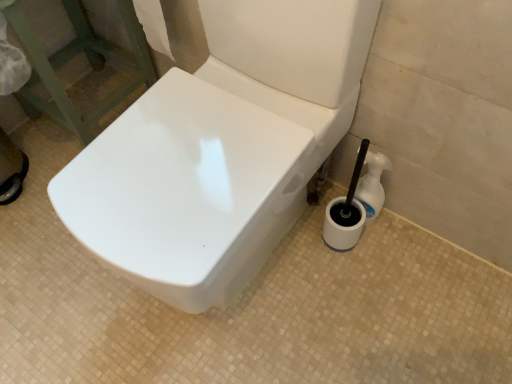
What do you see at coordinates (153, 25) in the screenshot?
I see `white paper at upper left` at bounding box center [153, 25].

Where is `white paper at upper left`? This screenshot has width=512, height=384. white paper at upper left is located at coordinates (153, 25).

Locate an element on the screen. The image size is (512, 384). white plastic bottle at lower right is located at coordinates (372, 185).

The height and width of the screenshot is (384, 512). What do you see at coordinates (372, 185) in the screenshot? I see `white plastic bottle at lower right` at bounding box center [372, 185].

Identify the location of white paper at upper left. This screenshot has height=384, width=512. (153, 25).

Which is more to the left, white plastic bottle at lower right or white paper at upper left?

white paper at upper left.

Which object is more forward, white plastic bottle at lower right or white paper at upper left?

white paper at upper left is more forward.

Does point (372, 187) appear closer or farther from the camera than point (156, 45)?

Point (372, 187).

From the image's perspective, between white plastic bottle at lower right and white paper at upper left, which one is located above?

white paper at upper left is shown above in the image.

From a real-world perspective, between white plastic bottle at lower right and white paper at upper left, who is vertically higher?

From a 3D spatial view, white paper at upper left is above.

Considering the sizes of objects white plastic bottle at lower right and white paper at upper left in the image provided, who is thinner, white plastic bottle at lower right or white paper at upper left?

With smaller width is white plastic bottle at lower right.

From their relative heights in the image, would you say white plastic bottle at lower right is taller or shorter than white paper at upper left?

In the image, white plastic bottle at lower right appears to be shorter than white paper at upper left.

Who is smaller, white plastic bottle at lower right or white paper at upper left?

Smaller between the two is white plastic bottle at lower right.

Is white plastic bottle at lower right outside of white paper at upper left?

Indeed, white plastic bottle at lower right is completely outside white paper at upper left.

Based on the photo, are white plastic bottle at lower right and white paper at upper left making contact?

No, white plastic bottle at lower right is not touching white paper at upper left.

Is white plastic bottle at lower right positioned with its back to white paper at upper left?

No, white paper at upper left is not at the back of white plastic bottle at lower right.

How different are the orientations of white plastic bottle at lower right and white paper at upper left in degrees?

They differ by 0.455 degrees in their facing directions.

You are a GUI agent. You are given a task and a screenshot of the screen. Output one action in this format:
    pyautogui.click(x=<x>, y=<y>)
    Task: Click on the toilet paper in front of the white plastic bottle at lower right
    Image resolution: width=512 pixels, height=384 pixels.
    Given the screenshot: What is the action you would take?
    pyautogui.click(x=153, y=25)

Which is more to the right, white paper at upper left or white plastic bottle at lower right?

From the viewer's perspective, white plastic bottle at lower right appears more on the right side.

From the picture: Is white paper at upper left closer to the viewer compared to white plastic bottle at lower right?

Yes, it is.

Does point (142, 24) lie behind point (365, 160)?

Yes, point (142, 24) is behind point (365, 160).

From the image's perspective, between white paper at upper left and white plastic bottle at lower right, which one is located above?

white paper at upper left.

From a real-world perspective, is white paper at upper left below white plastic bottle at lower right?

Actually, white paper at upper left is physically above white plastic bottle at lower right in the real world.

In terms of width, does white paper at upper left look wider or thinner when compared to white plastic bottle at lower right?

Considering their sizes, white paper at upper left looks broader than white plastic bottle at lower right.

In terms of height, does white paper at upper left look taller or shorter compared to white plastic bottle at lower right?

In the image, white paper at upper left appears to be taller than white plastic bottle at lower right.

Which of these two, white paper at upper left or white plastic bottle at lower right, is bigger?

With larger size is white paper at upper left.

Does white paper at upper left contain white plastic bottle at lower right?

That's incorrect, white plastic bottle at lower right is not inside white paper at upper left.

Based on the photo, is white paper at upper left positioned far away from white plastic bottle at lower right?

Actually, white paper at upper left and white plastic bottle at lower right are a little close together.

Is white paper at upper left positioned with its back to white plastic bottle at lower right?

No.

Can you tell me how much white paper at upper left and white plastic bottle at lower right differ in facing direction?

The angle between the facing direction of white paper at upper left and the facing direction of white plastic bottle at lower right is 0.455 degrees.

Measure the distance between white paper at upper left and white plastic bottle at lower right.

white paper at upper left is 25.33 inches away from white plastic bottle at lower right.

Locate an element on the screen. Image resolution: width=512 pixels, height=384 pixels. toilet paper above the white plastic bottle at lower right (from a real-world perspective) is located at coordinates (153, 25).

Image resolution: width=512 pixels, height=384 pixels. In order to click on toilet paper that is above the white plastic bottle at lower right (from a real-world perspective) in this screenshot , I will do `click(153, 25)`.

This screenshot has width=512, height=384. In order to click on toilet paper lying above the white plastic bottle at lower right (from the image's perspective) in this screenshot , I will do tap(153, 25).